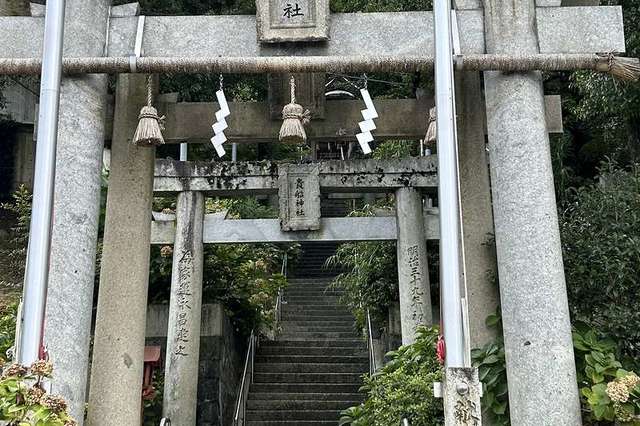
The width and height of the screenshot is (640, 426). Identify the location of leftmost foreground pillar. (68, 323).